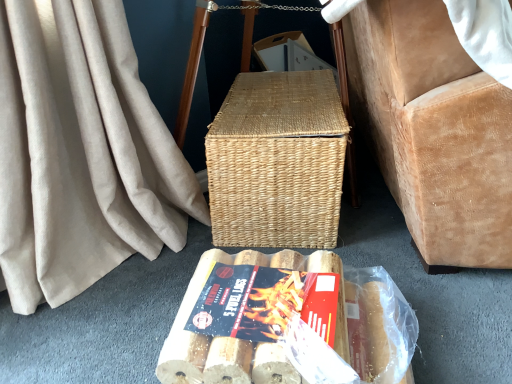
Question: Considering the relative sizes of wooden textured logs at center and woven natural picnic basket at center in the image provided, is wooden textured logs at center taller than woven natural picnic basket at center?

Choices:
 (A) yes
 (B) no

Answer: (B)

Question: Considering the relative sizes of wooden textured logs at center and woven natural picnic basket at center in the image provided, is wooden textured logs at center shorter than woven natural picnic basket at center?

Choices:
 (A) no
 (B) yes

Answer: (B)

Question: Considering the relative sizes of wooden textured logs at center and woven natural picnic basket at center in the image provided, is wooden textured logs at center thinner than woven natural picnic basket at center?

Choices:
 (A) yes
 (B) no

Answer: (A)

Question: Can you confirm if wooden textured logs at center is positioned to the left of woven natural picnic basket at center?

Choices:
 (A) no
 (B) yes

Answer: (B)

Question: Does wooden textured logs at center lie in front of woven natural picnic basket at center?

Choices:
 (A) yes
 (B) no

Answer: (A)

Question: Is wooden textured logs at center positioned far away from woven natural picnic basket at center?

Choices:
 (A) yes
 (B) no

Answer: (B)

Question: From the image's perspective, would you say wooden logs at lower center is shown under woven natural picnic basket at center?

Choices:
 (A) yes
 (B) no

Answer: (A)

Question: Is there a large distance between wooden logs at lower center and woven natural picnic basket at center?

Choices:
 (A) no
 (B) yes

Answer: (A)

Question: Considering the relative sizes of wooden logs at lower center and woven natural picnic basket at center in the image provided, is wooden logs at lower center thinner than woven natural picnic basket at center?

Choices:
 (A) yes
 (B) no

Answer: (B)

Question: Considering the relative positions of wooden logs at lower center and woven natural picnic basket at center in the image provided, is wooden logs at lower center in front of woven natural picnic basket at center?

Choices:
 (A) no
 (B) yes

Answer: (B)

Question: Is wooden logs at lower center facing towards woven natural picnic basket at center?

Choices:
 (A) no
 (B) yes

Answer: (A)

Question: Considering the relative positions of wooden logs at lower center and woven natural picnic basket at center in the image provided, is wooden logs at lower center to the right of woven natural picnic basket at center from the viewer's perspective?

Choices:
 (A) no
 (B) yes

Answer: (A)

Question: Can you confirm if wooden textured logs at center is smaller than wooden logs at lower center?

Choices:
 (A) no
 (B) yes

Answer: (B)